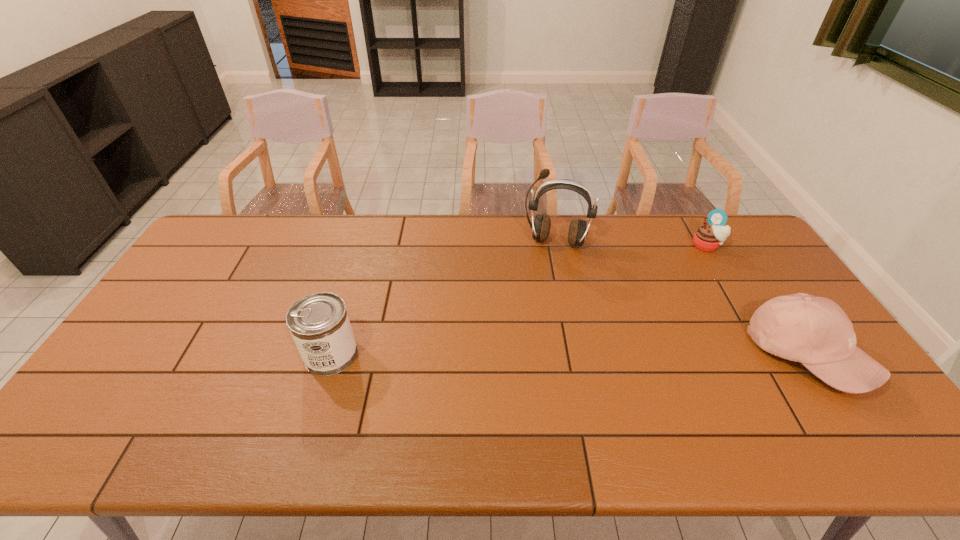
Find the location of `vacant area located on the front-facing side of the shortest object`. vacant area located on the front-facing side of the shortest object is located at coordinates (682, 274).

At what (x,y) coordinates should I click in order to perform the action: click on free space located on the front-facing side of the shortest object. Please return your answer as a coordinate pair (x, y). This screenshot has height=540, width=960. Looking at the image, I should click on (666, 292).

Where is `earphone positioned at the far edge`? earphone positioned at the far edge is located at coordinates (578, 230).

At what (x,y) coordinates should I click in order to perform the action: click on muffin at the far edge. Please return your answer as a coordinate pair (x, y). The width and height of the screenshot is (960, 540). Looking at the image, I should click on (708, 237).

Locate an element on the screen. This screenshot has width=960, height=540. object present at the near edge is located at coordinates (815, 331).

Locate an element on the screen. The image size is (960, 540). baseball cap that is at the right edge is located at coordinates (815, 331).

The height and width of the screenshot is (540, 960). Identify the location of muffin located at the right edge. (708, 237).

This screenshot has height=540, width=960. I want to click on object that is at the far right corner, so click(x=708, y=237).

Locate an element on the screen. object that is at the near right corner is located at coordinates (815, 331).

In the image, there is a desktop. At what (x,y) coordinates should I click in order to perform the action: click on vacant space at the far edge. Please return your answer as a coordinate pair (x, y). Looking at the image, I should click on (651, 222).